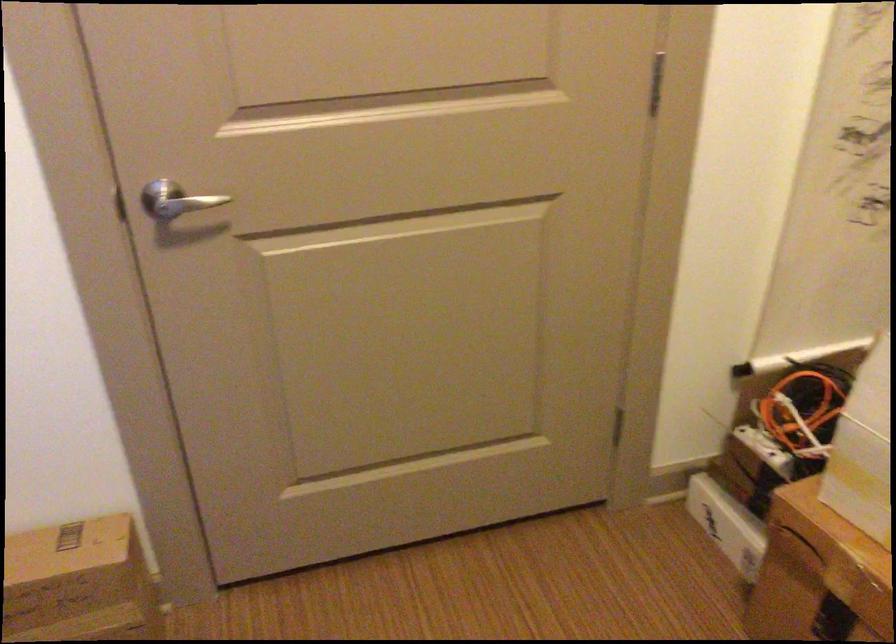
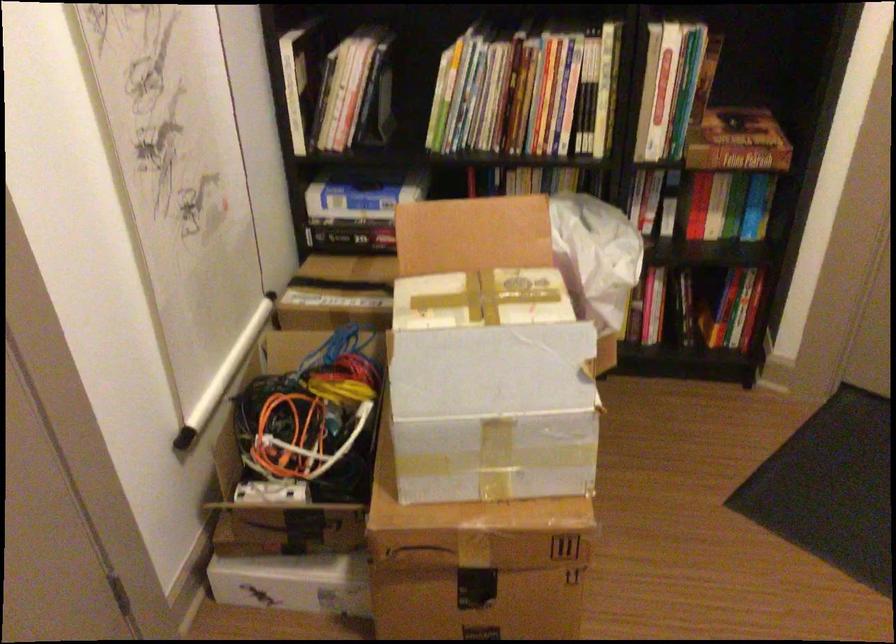
Question: The first image is from the beginning of the video and the second image is from the end. How did the camera likely rotate when shooting the video?

Choices:
 (A) Left
 (B) Right
 (C) Up
 (D) Down

Answer: (B)